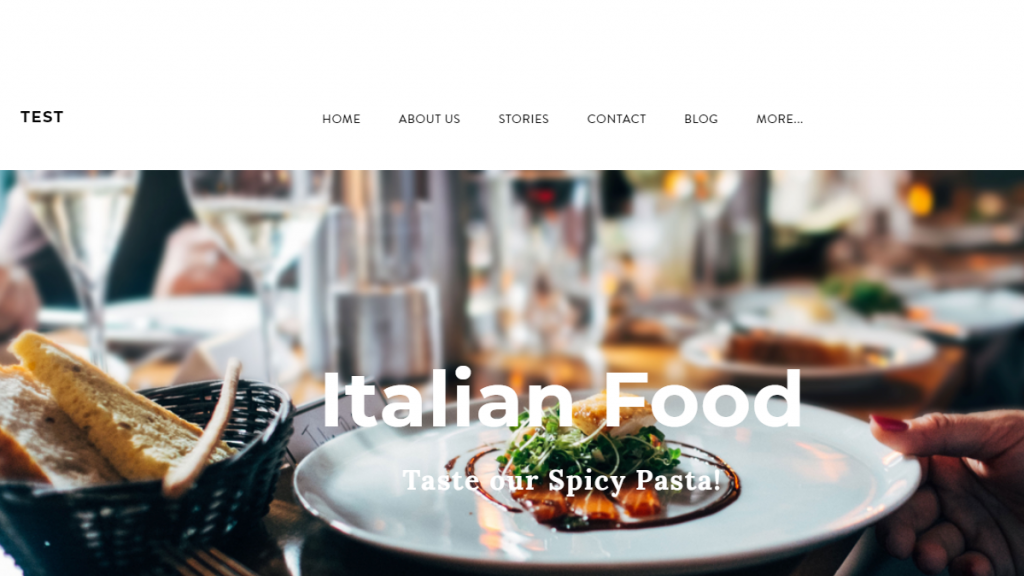
At what (x,y) coordinates should I click in order to perform the action: click on plate. Please return your answer as a coordinate pair (x, y). The width and height of the screenshot is (1024, 576). Looking at the image, I should click on (800, 505), (921, 353), (993, 309).